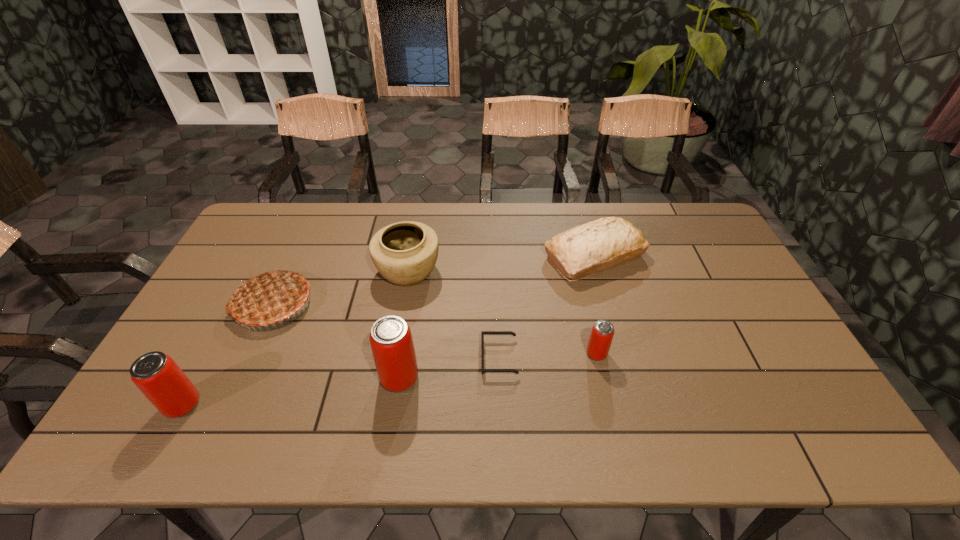
Find the location of a particular element. the leftmost beer can is located at coordinates (157, 376).

What are the coordinates of `the second beer can from right to left` in the screenshot? It's located at (391, 341).

Locate an element on the screen. The width and height of the screenshot is (960, 540). the rightmost beer can is located at coordinates [602, 333].

Find the location of a particular element. bread is located at coordinates (582, 251).

Find the location of a particular element. This screenshot has width=960, height=540. the third object from right to left is located at coordinates (483, 333).

Identify the location of the shortest object. This screenshot has width=960, height=540. (483, 333).

Where is `pottery`? The image size is (960, 540). pottery is located at coordinates coord(405,253).

The width and height of the screenshot is (960, 540). In order to click on pie in this screenshot , I will do `click(268, 298)`.

This screenshot has width=960, height=540. In order to click on free point located on the right of the leftmost beer can in this screenshot , I will do `click(308, 404)`.

You are a GUI agent. You are given a task and a screenshot of the screen. Output one action in this format:
    pyautogui.click(x=<x>, y=<y>)
    Task: Click on the vacant area situated 0.320m on the right of the second beer can from left to right
    
    Given the screenshot: What is the action you would take?
    pyautogui.click(x=545, y=378)